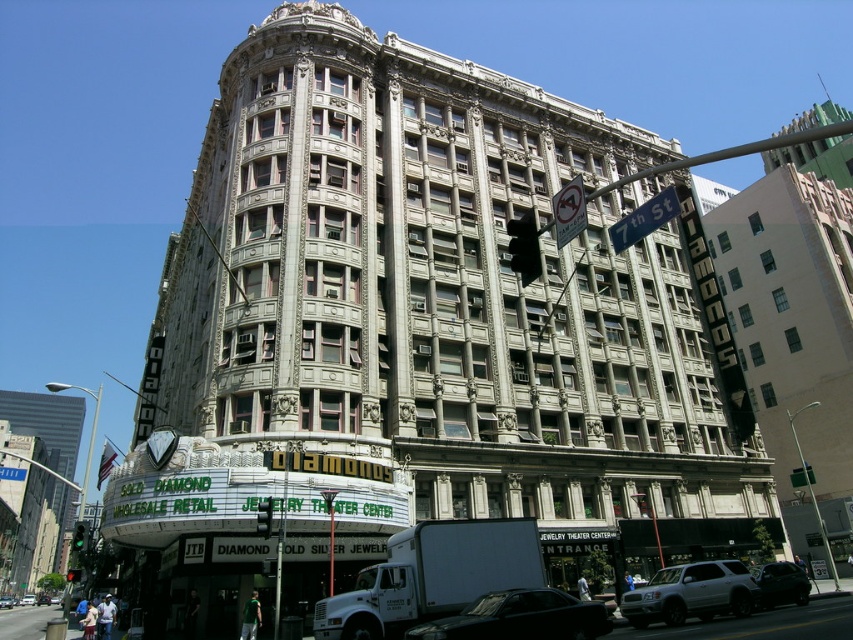
Who is taller, shiny black sedan at center or black glass traffic light at center?

black glass traffic light at center is taller.

Find the location of a particular element. This screenshot has height=640, width=853. shiny black sedan at center is located at coordinates (520, 618).

Which is in front, point (538, 627) or point (514, 227)?

Point (514, 227) is in front.

In order to click on shiny black sedan at center in this screenshot , I will do pos(520,618).

Is point (271, 512) farther from camera compared to point (67, 579)?

No, it is in front of (67, 579).

Image resolution: width=853 pixels, height=640 pixels. What do you see at coordinates (264, 516) in the screenshot? I see `green glass traffic light at center` at bounding box center [264, 516].

Find the location of a particular element. The width and height of the screenshot is (853, 640). green glass traffic light at center is located at coordinates (264, 516).

Does black glass traffic light at center have a greater width compared to green glass traffic light at upper center?

No, black glass traffic light at center is not wider than green glass traffic light at upper center.

Which is in front, point (521, 260) or point (86, 529)?

Positioned in front is point (521, 260).

Identify the location of black glass traffic light at center. (524, 248).